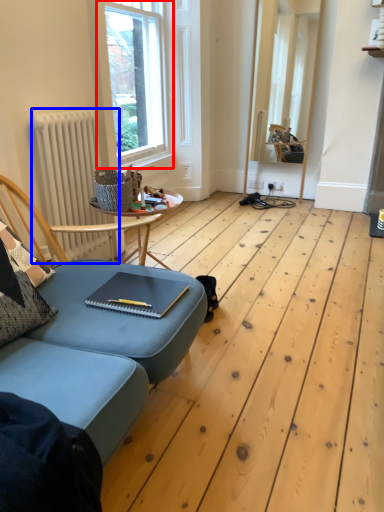
Question: Which object is closer to the camera taking this photo, window (highlighted by a red box) or radiator (highlighted by a blue box)?

Choices:
 (A) window
 (B) radiator

Answer: (B)